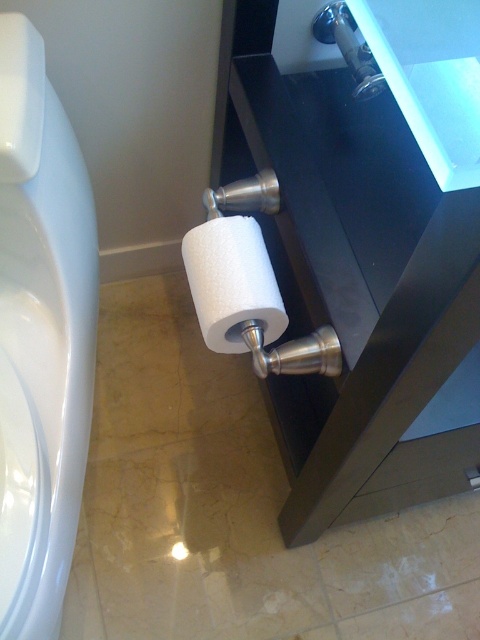
You are standing in the bathroom and need to locate the white glossy toilet bowl at lower left. According to the coordinates given, where exactly is it positioned?

The white glossy toilet bowl at lower left is positioned at point (x=40, y=336).

You are a cleaning robot with a width of 20 centimeters. You are positioned near the white glossy toilet bowl at lower left and need to reach the white matte toilet paper at lower center to clean it. Can you move directly towards it without any obstruction?

The distance between the white glossy toilet bowl at lower left and the white matte toilet paper at lower center is 21.36 centimeters. Since the robot is 20 centimeters wide, it can move towards the white matte toilet paper at lower center as the space is sufficient for its width.

Consider the image. You are standing in the bathroom and want to reach a point that is 30 inches away from you. Is the point at point coordinates point (26, 280) within reach?

The distance of point (26, 280) from viewer is 31.38 inches, so the point is 1.38 inches beyond the 30 inches reach.